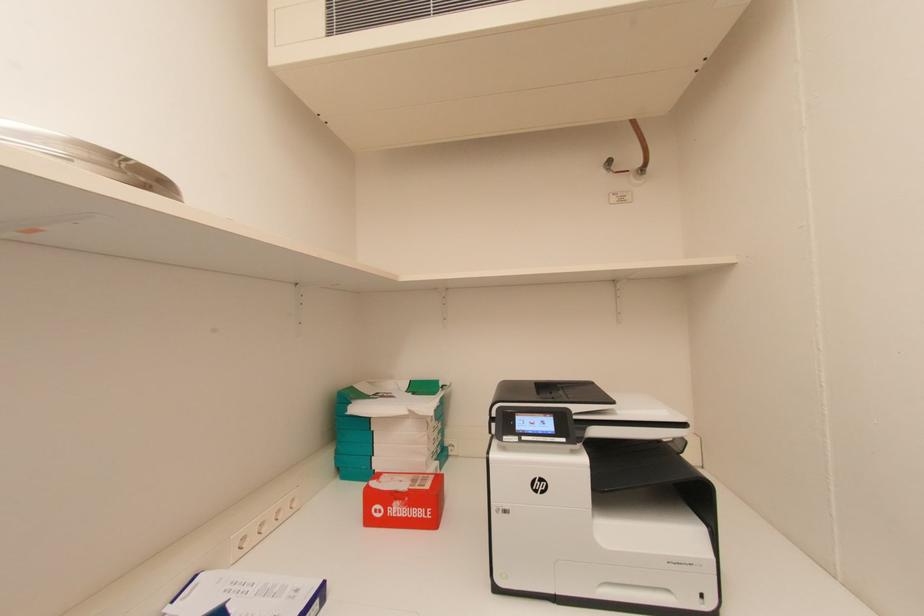
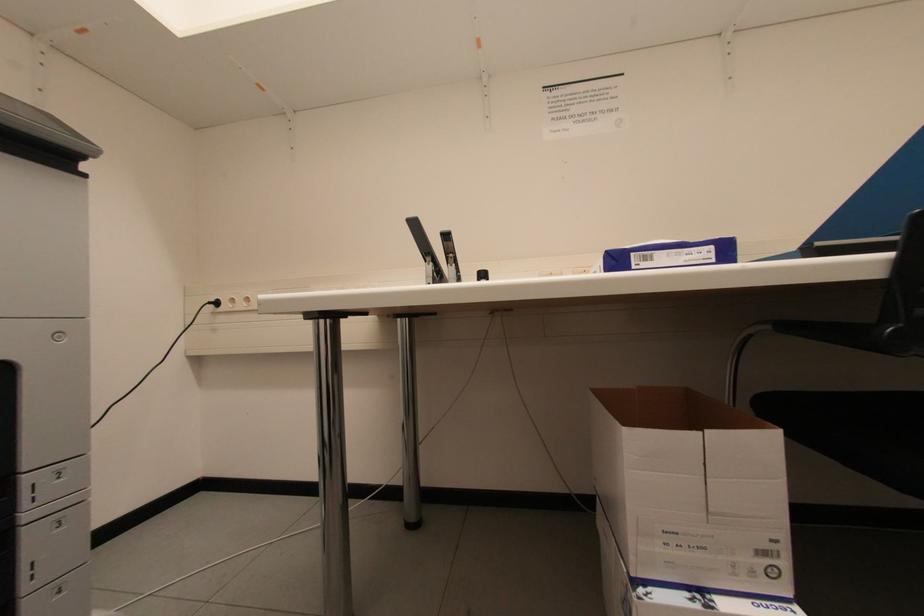
Question: The camera is either moving clockwise (left) or counter-clockwise (right) around the object. The first image is from the beginning of the video and the second image is from the end. Is the camera moving left or right when shooting the video?

Choices:
 (A) Left
 (B) Right

Answer: (B)